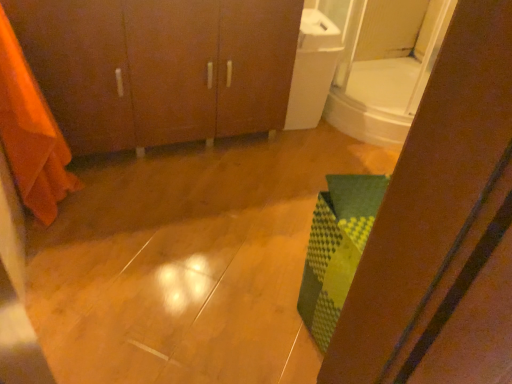
Question: Could you tell me if matte wood cabinet at upper left is turned towards orange fabric at left?

Choices:
 (A) yes
 (B) no

Answer: (A)

Question: Can you confirm if matte wood cabinet at upper left is bigger than orange fabric at left?

Choices:
 (A) yes
 (B) no

Answer: (A)

Question: Can you confirm if matte wood cabinet at upper left is positioned to the left of orange fabric at left?

Choices:
 (A) yes
 (B) no

Answer: (B)

Question: Is orange fabric at left completely or partially inside matte wood cabinet at upper left?

Choices:
 (A) yes
 (B) no

Answer: (B)

Question: Is matte wood cabinet at upper left not close to orange fabric at left?

Choices:
 (A) yes
 (B) no

Answer: (B)

Question: From a real-world perspective, is matte wood cabinet at upper left physically above orange fabric at left?

Choices:
 (A) no
 (B) yes

Answer: (A)

Question: From a real-world perspective, is orange fabric at left positioned over white glossy mirror at upper right based on gravity?

Choices:
 (A) yes
 (B) no

Answer: (B)

Question: Is orange fabric at left taller than white glossy mirror at upper right?

Choices:
 (A) yes
 (B) no

Answer: (A)

Question: Can you confirm if orange fabric at left is shorter than white glossy mirror at upper right?

Choices:
 (A) no
 (B) yes

Answer: (A)

Question: Is orange fabric at left oriented away from white glossy mirror at upper right?

Choices:
 (A) yes
 (B) no

Answer: (B)

Question: Are orange fabric at left and white glossy mirror at upper right far apart?

Choices:
 (A) yes
 (B) no

Answer: (A)

Question: Is orange fabric at left next to white glossy mirror at upper right?

Choices:
 (A) yes
 (B) no

Answer: (B)

Question: Is the position of matte wood cabinet at upper left less distant than that of white glossy mirror at upper right?

Choices:
 (A) yes
 (B) no

Answer: (A)